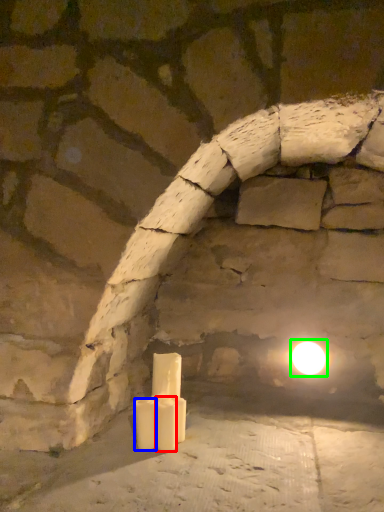
Question: Estimate the real-world distances between objects in this image. Which object is farther from candle (highlighted by a red box), candle (highlighted by a blue box) or moonlight (highlighted by a green box)?

Choices:
 (A) candle
 (B) moonlight

Answer: (B)